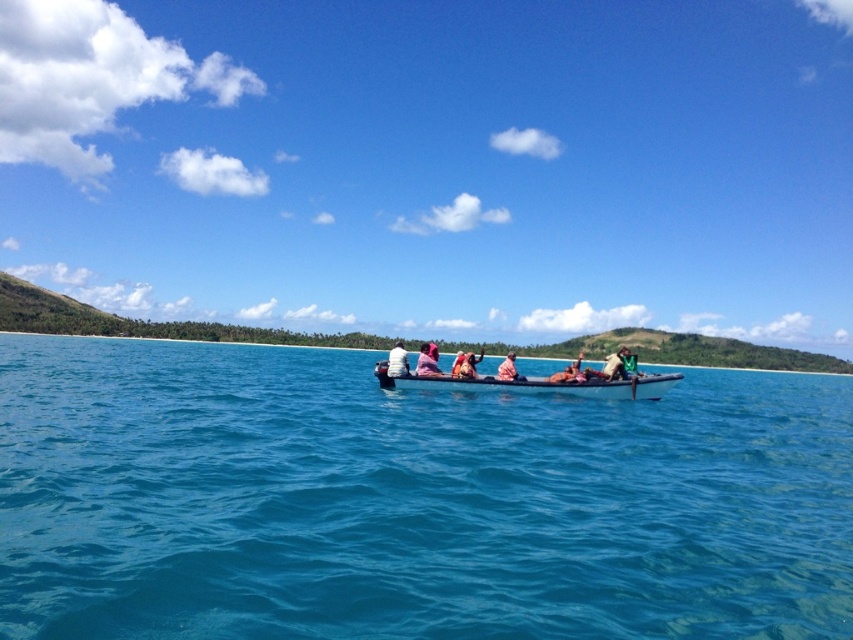
You are standing on the boat and want to point out both the blue water at center and the matte brown shirt at center to a friend. Which one is located to the left when facing the direction the boat is moving?

The blue water at center is to the left of the matte brown shirt at center when facing the direction the boat is moving.

You are navigating a boat and need to determine the direction of travel based on two reference points. The first reference point is at coordinate point [578,612], and the second is at point [602,368]. According to the scene, which point is closer to the boat?

Point [578,612] is in front of point [602,368], so it is closer to the boat.